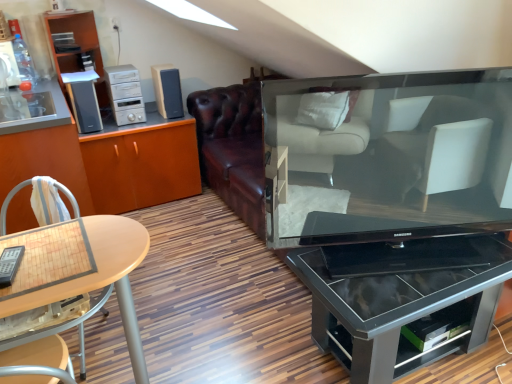
Question: Is black glossy television at center located outside matte wood shelf at upper left?

Choices:
 (A) yes
 (B) no

Answer: (A)

Question: From the image's perspective, is black glossy television at center above matte wood shelf at upper left?

Choices:
 (A) yes
 (B) no

Answer: (B)

Question: Considering the relative sizes of black glossy television at center and matte wood shelf at upper left in the image provided, is black glossy television at center wider than matte wood shelf at upper left?

Choices:
 (A) yes
 (B) no

Answer: (B)

Question: From the image's perspective, does black glossy television at center appear lower than matte wood shelf at upper left?

Choices:
 (A) yes
 (B) no

Answer: (A)

Question: Considering the relative sizes of black glossy television at center and matte wood shelf at upper left in the image provided, is black glossy television at center smaller than matte wood shelf at upper left?

Choices:
 (A) yes
 (B) no

Answer: (A)

Question: Visually, is matte wood shelf at upper left positioned to the left or to the right of matte wood cabinet at left, the 2th cabinetry from the left?

Choices:
 (A) left
 (B) right

Answer: (A)

Question: Considering their positions, is matte wood shelf at upper left located in front of or behind matte wood cabinet at left, positioned as the first cabinetry in right-to-left order?

Choices:
 (A) front
 (B) behind

Answer: (A)

Question: From the image's perspective, is matte wood shelf at upper left above or below matte wood cabinet at left, the 2th cabinetry from the left?

Choices:
 (A) below
 (B) above

Answer: (B)

Question: Based on their sizes in the image, would you say matte wood shelf at upper left is bigger or smaller than matte wood cabinet at left, the 2th cabinetry from the left?

Choices:
 (A) small
 (B) big

Answer: (A)

Question: From a real-world perspective, is wooden light brown chair at lower left positioned above or below matte wood cabinet at left, positioned as the first cabinetry in right-to-left order?

Choices:
 (A) below
 (B) above

Answer: (B)

Question: Relative to matte wood cabinet at left, positioned as the first cabinetry in right-to-left order, is wooden light brown chair at lower left in front or behind?

Choices:
 (A) front
 (B) behind

Answer: (A)

Question: Considering the positions of wooden light brown chair at lower left and matte wood cabinet at left, positioned as the first cabinetry in right-to-left order, in the image, is wooden light brown chair at lower left taller or shorter than matte wood cabinet at left, positioned as the first cabinetry in right-to-left order,?

Choices:
 (A) tall
 (B) short

Answer: (B)

Question: Is wooden light brown chair at lower left bigger or smaller than matte wood cabinet at left, positioned as the first cabinetry in right-to-left order?

Choices:
 (A) small
 (B) big

Answer: (A)

Question: In the image, is silver metallic stereo at upper left, the 1th appliance in the right-to-left sequence, on the left side or the right side of white woven fabric at left?

Choices:
 (A) left
 (B) right

Answer: (B)

Question: In terms of height, does silver metallic stereo at upper left, the 1th appliance in the right-to-left sequence, look taller or shorter compared to white woven fabric at left?

Choices:
 (A) tall
 (B) short

Answer: (A)